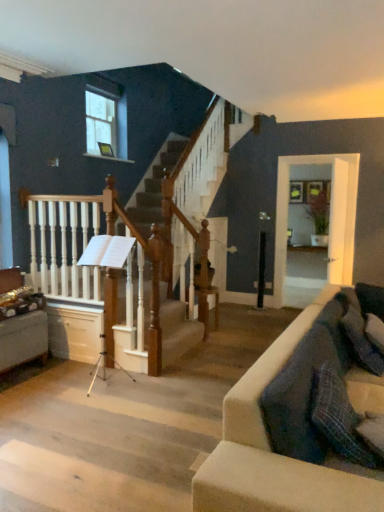
Question: Is white wood railing at left next to clear glass window at upper left?

Choices:
 (A) yes
 (B) no

Answer: (B)

Question: Considering the relative sizes of white wood railing at left and clear glass window at upper left in the image provided, is white wood railing at left shorter than clear glass window at upper left?

Choices:
 (A) yes
 (B) no

Answer: (B)

Question: Can clear glass window at upper left be found inside white wood railing at left?

Choices:
 (A) yes
 (B) no

Answer: (B)

Question: Is white wood railing at left to the right of clear glass window at upper left from the viewer's perspective?

Choices:
 (A) yes
 (B) no

Answer: (A)

Question: Is white wood railing at left thinner than clear glass window at upper left?

Choices:
 (A) no
 (B) yes

Answer: (A)

Question: Is white wood railing at left smaller than clear glass window at upper left?

Choices:
 (A) yes
 (B) no

Answer: (B)

Question: Considering the relative sizes of clear glass window at upper left and white wood railing at left in the image provided, is clear glass window at upper left bigger than white wood railing at left?

Choices:
 (A) no
 (B) yes

Answer: (A)

Question: Are clear glass window at upper left and white wood railing at left far apart?

Choices:
 (A) yes
 (B) no

Answer: (A)

Question: Is clear glass window at upper left positioned in front of white wood railing at left?

Choices:
 (A) yes
 (B) no

Answer: (B)

Question: Is clear glass window at upper left behind white wood railing at left?

Choices:
 (A) yes
 (B) no

Answer: (A)

Question: From a real-world perspective, is clear glass window at upper left on top of white wood railing at left?

Choices:
 (A) no
 (B) yes

Answer: (B)

Question: Is clear glass window at upper left oriented away from white wood railing at left?

Choices:
 (A) no
 (B) yes

Answer: (A)

Question: Is white wood railing at left inside the boundaries of clear glass window at upper left, or outside?

Choices:
 (A) outside
 (B) inside

Answer: (A)